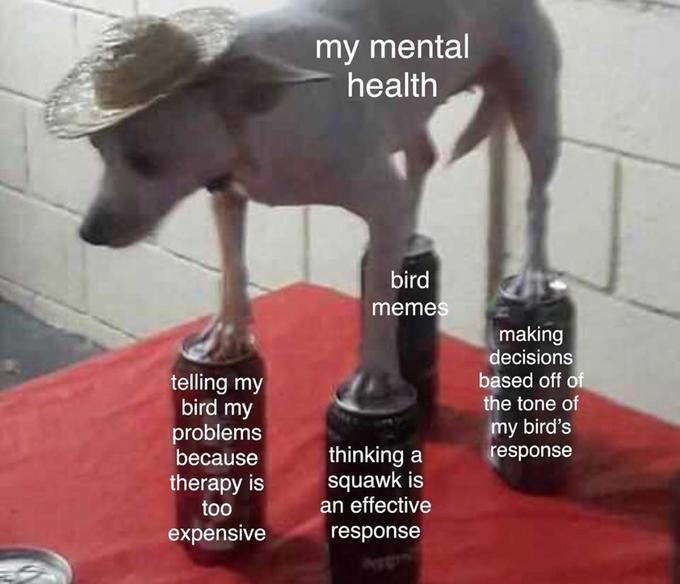
At what (x,y) coordinates should I click in order to perform the action: click on grey floor. Please return your answer as a coordinate pair (x, y). This screenshot has height=584, width=680. Looking at the image, I should click on (48, 342).